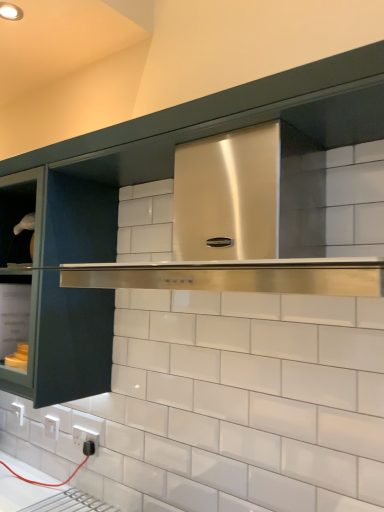
What do you see at coordinates (51, 426) in the screenshot? I see `white plastic electric outlet at lower left, placed as the 1th electric outlet when sorted from back to front` at bounding box center [51, 426].

Where is `white plastic electric outlet at lower left, positioned as the first electric outlet in left-to-right order`? white plastic electric outlet at lower left, positioned as the first electric outlet in left-to-right order is located at coordinates (51, 426).

From the image's perspective, is stainless steel range hood at center located above matte black cabinet door at left?

Yes, from the image's perspective, stainless steel range hood at center is over matte black cabinet door at left.

From a real-world perspective, which object stands above the other?

stainless steel range hood at center, from a real-world perspective.

Does point (220, 101) lie in front of point (98, 197)?

Yes.

From a real-world perspective, which object stands above the other?

matte black cabinet door at left, from a real-world perspective.

Considering the relative positions of white plastic electric outlet at lower left, marked as the 2th electric outlet in a right-to-left arrangement, and matte black cabinet door at left in the image provided, is white plastic electric outlet at lower left, marked as the 2th electric outlet in a right-to-left arrangement, in front of matte black cabinet door at left?

No, white plastic electric outlet at lower left, marked as the 2th electric outlet in a right-to-left arrangement, is behind matte black cabinet door at left.

In the image, there is a white plastic electric outlet at lower left, which is the 2th electric outlet in front-to-back order. At what (x,y) coordinates should I click in order to perform the action: click on glass door above it (from the image's perspective). Please return your answer as a coordinate pair (x, y). The height and width of the screenshot is (512, 384). Looking at the image, I should click on (58, 281).

Considering the positions of objects white plastic electric outlet at lower left, which is the 2th electric outlet in front-to-back order, and matte black cabinet door at left in the image provided, who is more to the right, white plastic electric outlet at lower left, which is the 2th electric outlet in front-to-back order, or matte black cabinet door at left?

From the viewer's perspective, white plastic electric outlet at lower left, which is the 2th electric outlet in front-to-back order, appears more on the right side.

Which is more to the left, matte black cabinet door at left or white plastic electric outlet at lower left, marked as the 2th electric outlet in a right-to-left arrangement?

matte black cabinet door at left.

In the image, is matte black cabinet door at left positioned in front of or behind white plastic electric outlet at lower left, placed as the 1th electric outlet when sorted from back to front?

matte black cabinet door at left is in front of white plastic electric outlet at lower left, placed as the 1th electric outlet when sorted from back to front.

From the image's perspective, which one is positioned higher, matte black cabinet door at left or white plastic electric outlet at lower left, positioned as the first electric outlet in left-to-right order?

From the image's view, matte black cabinet door at left is above.

There is a matte black cabinet door at left. Find the location of `the 2nd electric outlet below it (from a real-world perspective)`. the 2nd electric outlet below it (from a real-world perspective) is located at coordinates (51, 426).

From the image's perspective, is matte black cabinet door at left on black plastic electric outlet at lower left, the first electric outlet in the right-to-left sequence?

Yes, from the image's perspective, matte black cabinet door at left is on top of black plastic electric outlet at lower left, the first electric outlet in the right-to-left sequence.

Where is `glass door located on the left of black plastic electric outlet at lower left, which appears as the 2th electric outlet when viewed from the left`? glass door located on the left of black plastic electric outlet at lower left, which appears as the 2th electric outlet when viewed from the left is located at coordinates (58, 281).

Measure the distance between matte black cabinet door at left and black plastic electric outlet at lower left, placed as the first electric outlet when sorted from front to back.

The distance of matte black cabinet door at left from black plastic electric outlet at lower left, placed as the first electric outlet when sorted from front to back, is 21.49 inches.

Is matte black cabinet door at left not within black plastic electric outlet at lower left, the second electric outlet viewed from the back?

matte black cabinet door at left is positioned outside black plastic electric outlet at lower left, the second electric outlet viewed from the back.

Considering the positions of objects white plastic electric outlet at lower left, marked as the 2th electric outlet in a right-to-left arrangement, and stainless steel range hood at center in the image provided, who is more to the right, white plastic electric outlet at lower left, marked as the 2th electric outlet in a right-to-left arrangement, or stainless steel range hood at center?

stainless steel range hood at center is more to the right.

Considering the relative sizes of white plastic electric outlet at lower left, which is the 2th electric outlet in front-to-back order, and stainless steel range hood at center in the image provided, is white plastic electric outlet at lower left, which is the 2th electric outlet in front-to-back order, shorter than stainless steel range hood at center?

Yes.

Which of these two, white plastic electric outlet at lower left, placed as the 1th electric outlet when sorted from back to front, or stainless steel range hood at center, is wider?

With larger width is stainless steel range hood at center.

Measure the distance between stainless steel range hood at center and white plastic electric outlet at lower left, marked as the 2th electric outlet in a right-to-left arrangement.

stainless steel range hood at center and white plastic electric outlet at lower left, marked as the 2th electric outlet in a right-to-left arrangement, are 35.24 inches apart from each other.

Does stainless steel range hood at center have a lesser width compared to white plastic electric outlet at lower left, placed as the 1th electric outlet when sorted from back to front?

No.

Looking at this image, from the image's perspective, which one is positioned higher, stainless steel range hood at center or white plastic electric outlet at lower left, which is the 2th electric outlet in front-to-back order?

stainless steel range hood at center is shown above in the image.

Between point (301, 106) and point (52, 424), which one is positioned behind?

Point (52, 424)

From the image's perspective, relative to stainless steel range hood at center, is matte black cabinet door at left above or below?

matte black cabinet door at left is below stainless steel range hood at center.

Does matte black cabinet door at left turn towards stainless steel range hood at center?

No, matte black cabinet door at left does not turn towards stainless steel range hood at center.

At what (x,y) coordinates should I click in order to perform the action: click on glass door below the stainless steel range hood at center (from a real-world perspective). Please return your answer as a coordinate pair (x, y). Looking at the image, I should click on 58,281.

Which is more to the left, matte black cabinet door at left or stainless steel range hood at center?

matte black cabinet door at left is more to the left.

Identify the location of cabinetry lying above the matte black cabinet door at left (from the image's perspective). The height and width of the screenshot is (512, 384). (193, 139).

You are a GUI agent. You are given a task and a screenshot of the screen. Output one action in this format:
    pyautogui.click(x=<x>, y=<y>)
    Task: Click on the 2nd electric outlet below the matte black cabinet door at left (from the image's perspective)
    
    Given the screenshot: What is the action you would take?
    pyautogui.click(x=51, y=426)

Looking at the image, which one is located further to matte black cabinet door at left, black plastic electric outlet at lower left, the first electric outlet in the right-to-left sequence, or white plastic electric outlet at lower left, positioned as the first electric outlet in left-to-right order?

white plastic electric outlet at lower left, positioned as the first electric outlet in left-to-right order.

From the image, which object appears to be nearer to white plastic electric outlet at lower left, positioned as the first electric outlet in left-to-right order, black plastic electric outlet at lower left, which appears as the 2th electric outlet when viewed from the left, or stainless steel range hood at center?

black plastic electric outlet at lower left, which appears as the 2th electric outlet when viewed from the left, is positioned closer to the anchor white plastic electric outlet at lower left, positioned as the first electric outlet in left-to-right order.

Estimate the real-world distances between objects in this image. Which object is further from white plastic electric outlet at lower left, placed as the 1th electric outlet when sorted from back to front, matte black cabinet door at left or black plastic electric outlet at lower left, the first electric outlet in the right-to-left sequence?

matte black cabinet door at left is positioned further to the anchor white plastic electric outlet at lower left, placed as the 1th electric outlet when sorted from back to front.

Looking at the image, which one is located further to black plastic electric outlet at lower left, placed as the first electric outlet when sorted from front to back, matte black cabinet door at left or stainless steel range hood at center?

stainless steel range hood at center lies further to black plastic electric outlet at lower left, placed as the first electric outlet when sorted from front to back, than the other object.

From the picture: Estimate the real-world distances between objects in this image. Which object is closer to matte black cabinet door at left, white plastic electric outlet at lower left, positioned as the first electric outlet in left-to-right order, or stainless steel range hood at center?

Based on the image, stainless steel range hood at center appears to be nearer to matte black cabinet door at left.

From the image, which object appears to be nearer to stainless steel range hood at center, white plastic electric outlet at lower left, which is the 2th electric outlet in front-to-back order, or matte black cabinet door at left?

matte black cabinet door at left is positioned closer to the anchor stainless steel range hood at center.

Considering their positions, is black plastic electric outlet at lower left, the first electric outlet in the right-to-left sequence, positioned closer to stainless steel range hood at center than white plastic electric outlet at lower left, positioned as the first electric outlet in left-to-right order?

Based on the image, black plastic electric outlet at lower left, the first electric outlet in the right-to-left sequence, appears to be nearer to stainless steel range hood at center.

Looking at the image, which one is located further to white plastic electric outlet at lower left, marked as the 2th electric outlet in a right-to-left arrangement, matte black cabinet door at left or stainless steel range hood at center?

stainless steel range hood at center.

This screenshot has width=384, height=512. Identify the location of electric outlet between stainless steel range hood at center and white plastic electric outlet at lower left, placed as the 1th electric outlet when sorted from back to front, in the front-back direction. (86, 440).

The height and width of the screenshot is (512, 384). Find the location of `glass door between stainless steel range hood at center and black plastic electric outlet at lower left, the second electric outlet viewed from the back, along the z-axis`. glass door between stainless steel range hood at center and black plastic electric outlet at lower left, the second electric outlet viewed from the back, along the z-axis is located at coordinates (58, 281).

At what (x,y) coordinates should I click in order to perform the action: click on glass door between stainless steel range hood at center and white plastic electric outlet at lower left, which is the 2th electric outlet in front-to-back order, from front to back. Please return your answer as a coordinate pair (x, y). This screenshot has height=512, width=384. Looking at the image, I should click on (58, 281).

Find the location of a particular element. The image size is (384, 512). electric outlet between matte black cabinet door at left and white plastic electric outlet at lower left, which is the 2th electric outlet in front-to-back order, in the vertical direction is located at coordinates (86, 440).